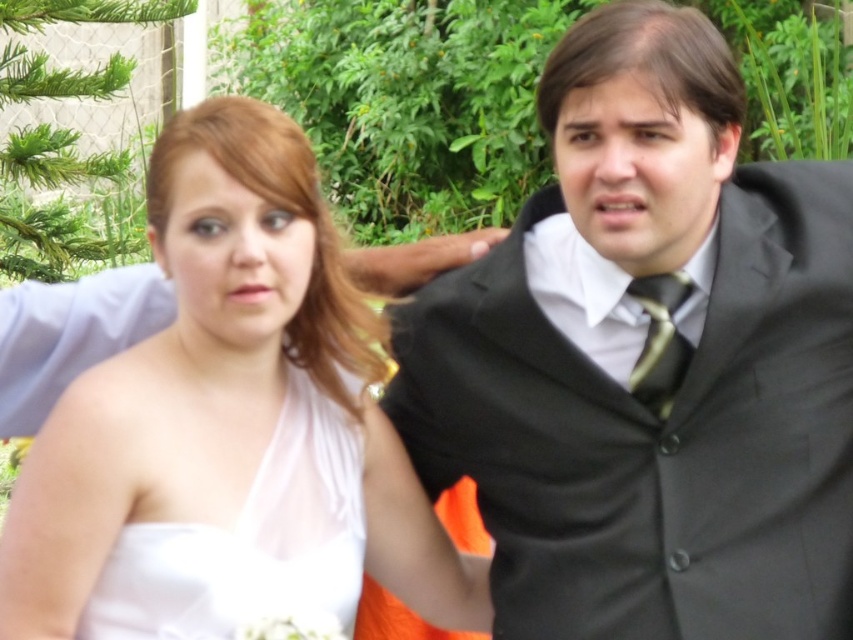
Does black satin suit at center have a lesser width compared to white satin dress at center?

In fact, black satin suit at center might be wider than white satin dress at center.

Can you confirm if black satin suit at center is smaller than white satin dress at center?

No, black satin suit at center is not smaller than white satin dress at center.

Is point (653, 120) positioned before point (169, 476)?

Yes, point (653, 120) is closer to viewer.

This screenshot has height=640, width=853. Find the location of `black satin suit at center`. black satin suit at center is located at coordinates (683, 376).

Is white satin dress at center taller than green striped tie at center?

Indeed, white satin dress at center has a greater height compared to green striped tie at center.

Who is positioned more to the right, white satin dress at center or green striped tie at center?

green striped tie at center

Does point (143, 508) lie behind point (676, 276)?

No, it is in front of (676, 276).

You are a GUI agent. You are given a task and a screenshot of the screen. Output one action in this format:
    pyautogui.click(x=<x>, y=<y>)
    Task: Click on the white satin dress at center
    Image resolution: width=853 pixels, height=640 pixels.
    Given the screenshot: What is the action you would take?
    pyautogui.click(x=229, y=428)

Who is more forward, (x=177, y=545) or (x=666, y=300)?

Point (x=177, y=545) is in front.

Does white satin dress at left appear over green striped tie at center?

Incorrect, white satin dress at left is not positioned above green striped tie at center.

The image size is (853, 640). What do you see at coordinates (250, 541) in the screenshot?
I see `white satin dress at left` at bounding box center [250, 541].

This screenshot has height=640, width=853. I want to click on white satin dress at left, so click(x=250, y=541).